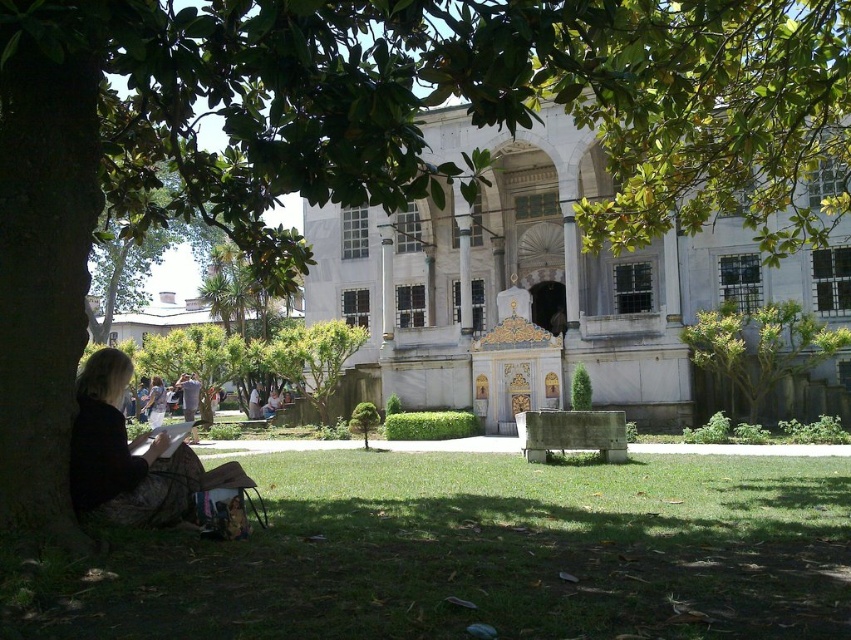
You are standing at the center of the historical building in the image. If you look towards the green leafy tree at right, in which direction should you face?

The green leafy tree at right is located at point coordinates of 0.547 on the x axis and 0.892 on the y axis. Since the building is symmetrical with a central entrance, facing the central entrance would mean you are facing north. The coordinates suggest the tree is to the right side of the image, so you should turn to your right to face the green leafy tree at right.

You are a tourist visiting the historical site and want to take a photo of the white marble palace at center without any people in the frame. Can you see the blonde hair at lower left from your current position in front of the palace?

The blonde hair at lower left is behind the white marble palace at center, so you cannot see the blonde hair at lower left from your current position in front of the palace. This means the photo would not have any people in the frame.

You are planning to take a photo of the white marble palace at center and the green leafy tree at right. If you want to include both in the frame, should you zoom in or zoom out?

The white marble palace at center might be wider than the green leafy tree at right, so to include both in the frame, you should zoom out to capture the wider structure of the palace and the tree.